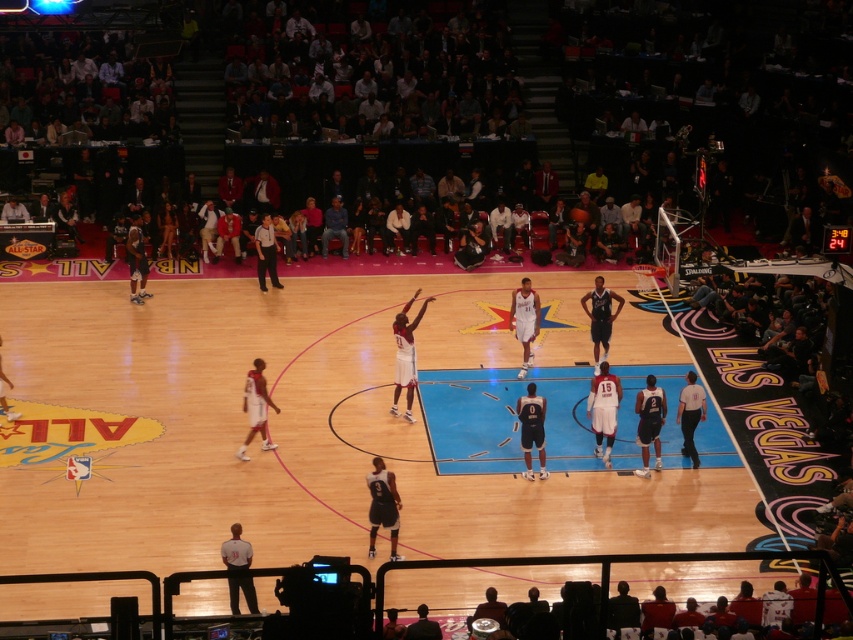
You are a referee at the NBA All Star game in Las Vegas. You need to ensure that the players are positioned correctly during a free throw. According to the official NBA rules, the shooter must be at least 4.57 meters away from the basketball during a free throw. Based on the image, is the distance between the white glossy jersey at center and the shiny black basketball at center compliant with the rule?

The white glossy jersey at center and the shiny black basketball at center are 9.70 meters apart, which is more than the required 4.57 meters. Therefore, the distance is compliant with the NBA rule.

You are a referee at the NBA All Star game in Las Vegas. You notice a black matte basketball at center and a dark blue jersey at center. Which object is located to the left of the other?

The black matte basketball at center is positioned on the left side of dark blue jersey at center.

You are a photographer at the NBA All Star game in Las Vegas. You need to capture a photo that includes both the shiny red jersey at left and the dark blue jersey at center. Given the spatial arrangement, which jersey will appear smaller in the photo?

The shiny red jersey at left occupies less space than the dark blue jersey at center, so it will appear smaller in the photo.